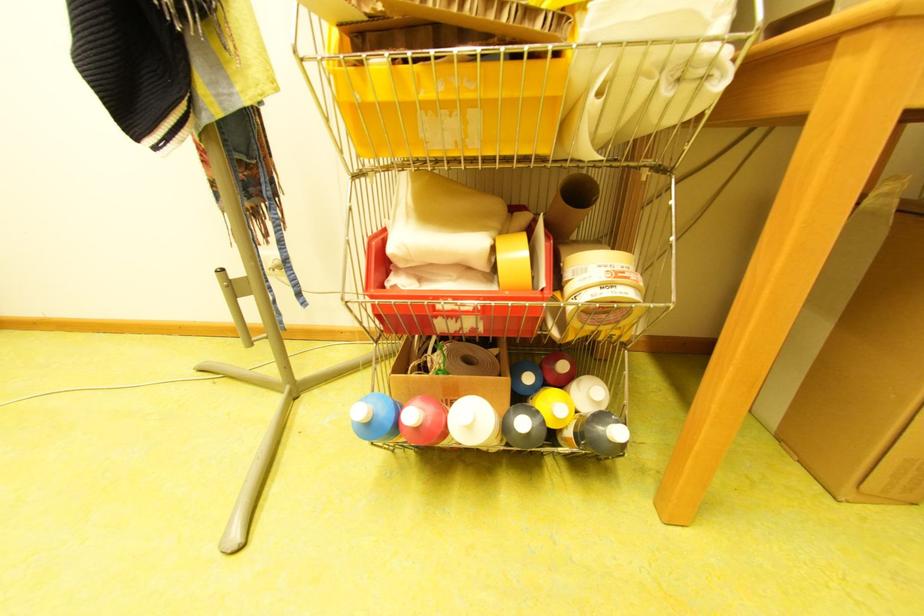
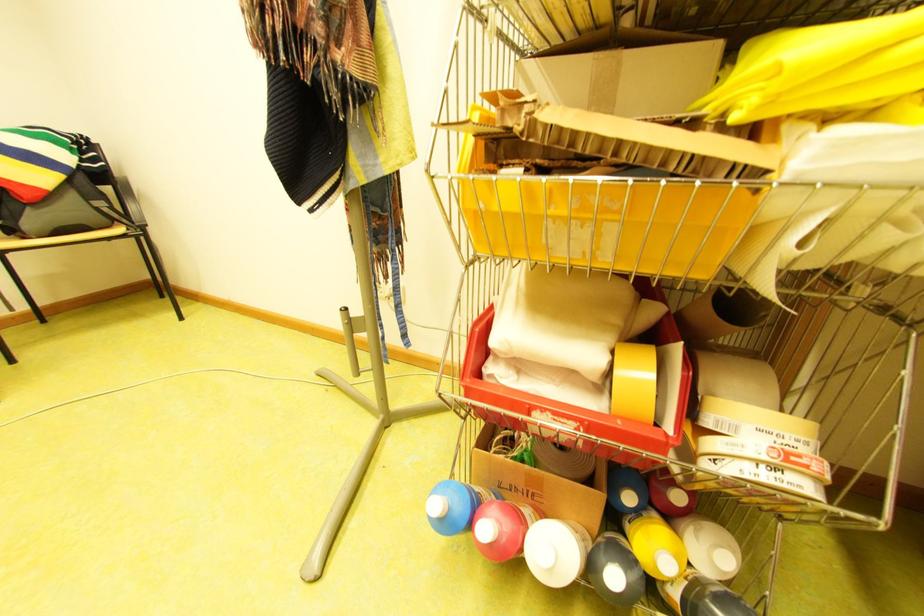
The point at (588, 421) is marked in the first image. Where is the corresponding point in the second image?

(699, 584)